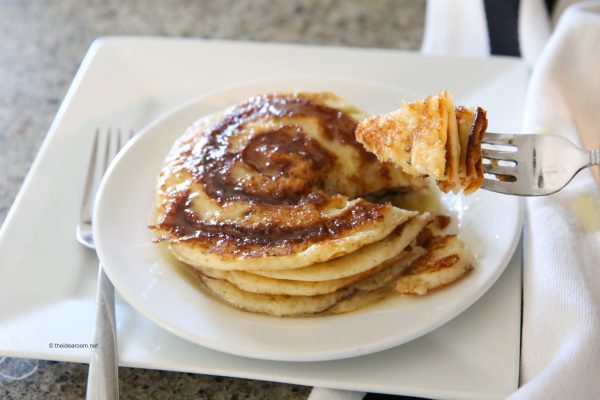
Image resolution: width=600 pixels, height=400 pixels. What are the coordinates of `round plate` in the screenshot? It's located at (341, 340).